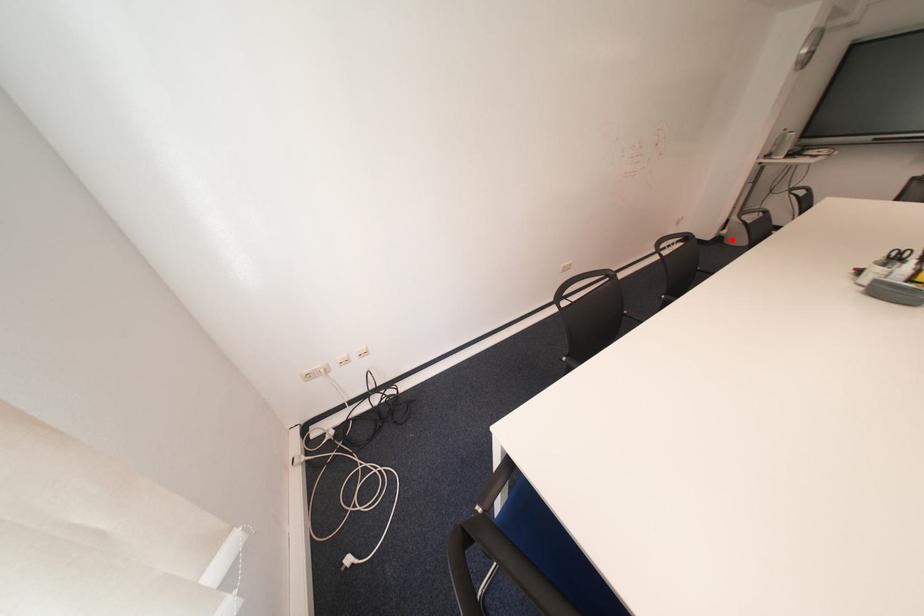
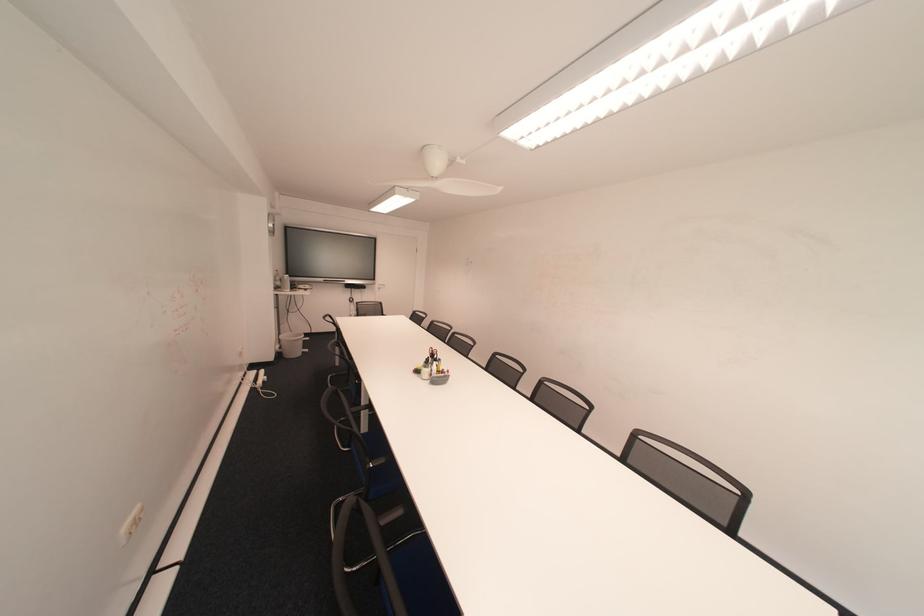
Question: I am providing you with two images of the same scene from different viewpoints. A red point is shown in image1. For the corresponding object point in image2, is it positioned nearer or farther from the camera?

Choices:
 (A) Nearer
 (B) Farther

Answer: (B)